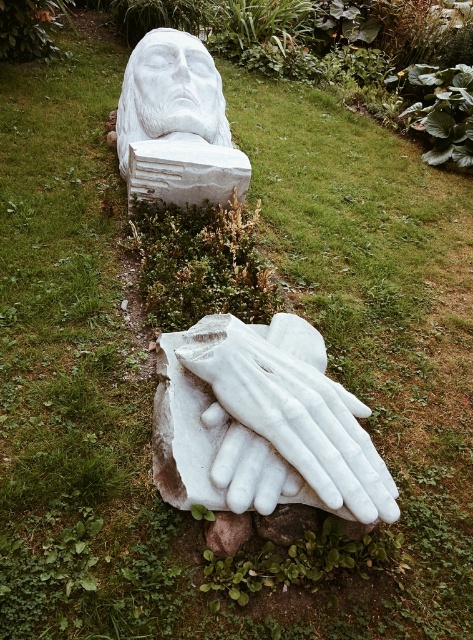
Question: From the image, what is the correct spatial relationship of white marble head at upper center in relation to brown rough stone at lower center?

Choices:
 (A) above
 (B) below

Answer: (A)

Question: Observing the image, what is the correct spatial positioning of white marble head at upper center in reference to smooth stone at lower center?

Choices:
 (A) left
 (B) right

Answer: (A)

Question: Among these points, which one is farthest from the camera?

Choices:
 (A) click(187, 100)
 (B) click(218, 532)

Answer: (A)

Question: Can you confirm if smooth stone at lower center is positioned to the right of brown rough stone at lower center?

Choices:
 (A) yes
 (B) no

Answer: (A)

Question: Among these points, which one is nearest to the camera?

Choices:
 (A) (266, 536)
 (B) (236, 547)
 (C) (148, 52)

Answer: (B)

Question: Considering the real-world distances, which object is farthest from the white marble head at upper center?

Choices:
 (A) brown rough stone at lower center
 (B) smooth stone at lower center
 (C) white marble hand at center

Answer: (A)